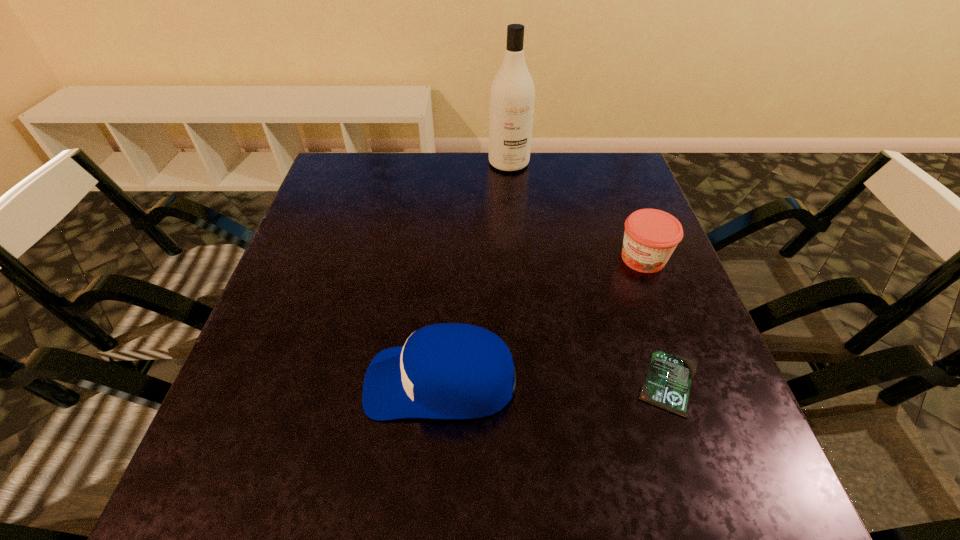
Locate an element on the screen. The height and width of the screenshot is (540, 960). free spot located on the front label of the jam is located at coordinates (541, 380).

Find the location of a particular element. The width and height of the screenshot is (960, 540). vacant space located 0.120m on the front label of the jam is located at coordinates (606, 304).

Identify the location of blank space located on the front-facing side of the tallest object. This screenshot has height=540, width=960. (519, 197).

Identify the location of free space located 0.220m on the front-facing side of the tallest object. (528, 221).

Locate an element on the screen. This screenshot has height=540, width=960. vacant space located 0.110m on the front-facing side of the tallest object is located at coordinates (519, 197).

At what (x,y) coordinates should I click in order to perform the action: click on object that is at the far edge. Please return your answer as a coordinate pair (x, y). The image size is (960, 540). Looking at the image, I should click on (512, 94).

Find the location of a particular element. The width and height of the screenshot is (960, 540). baseball cap present at the near edge is located at coordinates (449, 370).

This screenshot has width=960, height=540. I want to click on identity card that is at the near edge, so point(667,386).

You are a GUI agent. You are given a task and a screenshot of the screen. Output one action in this format:
    pyautogui.click(x=<x>, y=<y>)
    Task: Click on the identity card that is at the right edge
    This screenshot has height=540, width=960.
    Given the screenshot: What is the action you would take?
    pyautogui.click(x=667, y=386)

At what (x,y) coordinates should I click in order to perform the action: click on jam that is at the right edge. Please return your answer as a coordinate pair (x, y). Looking at the image, I should click on (650, 237).